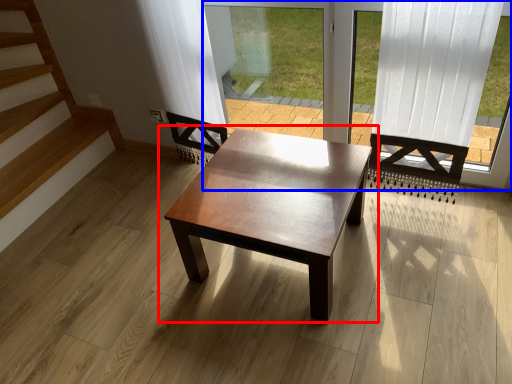
Question: Which object is further to the camera taking this photo, coffee table (highlighted by a red box) or window frame (highlighted by a blue box)?

Choices:
 (A) coffee table
 (B) window frame

Answer: (A)